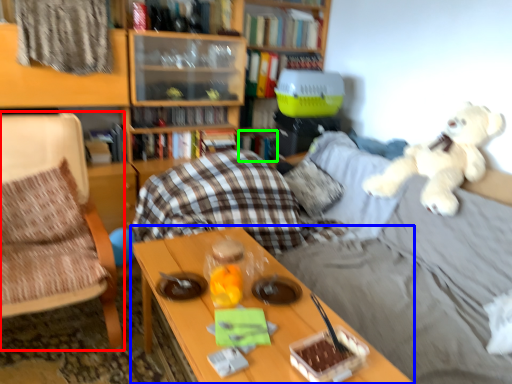
Question: Which object is the farthest from chair (highlighted by a red box)? Choose among these: table (highlighted by a blue box) or book (highlighted by a green box).

Choices:
 (A) table
 (B) book

Answer: (B)